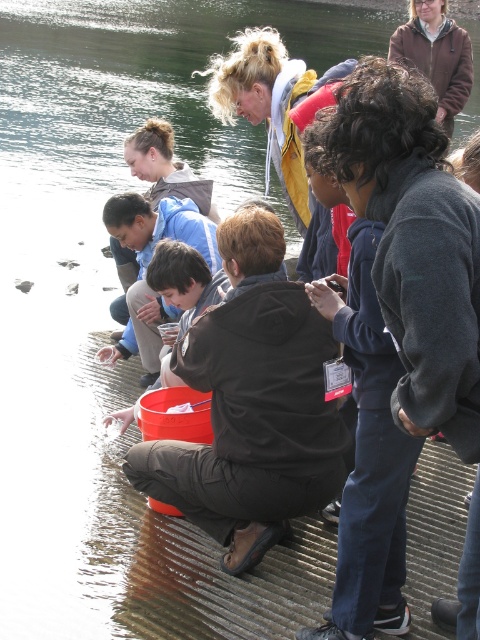
Between point (206, 476) and point (427, 228), which one is positioned behind?

The point (206, 476) is more distant.

The width and height of the screenshot is (480, 640). What do you see at coordinates (252, 404) in the screenshot?
I see `black matte jacket at center` at bounding box center [252, 404].

Which is behind, point (272, 332) or point (420, 348)?

Point (272, 332)

In order to click on black matte jacket at center in this screenshot , I will do `click(252, 404)`.